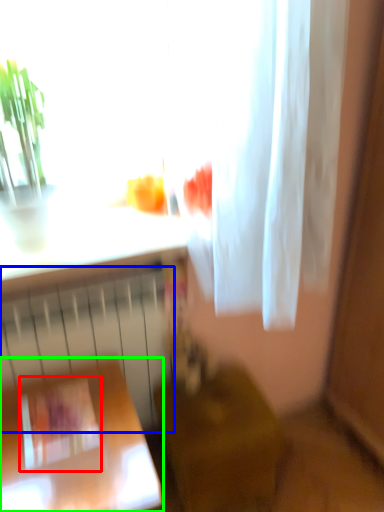
Question: Estimate the real-world distances between objects in this image. Which object is farther from square (highlighted by a red box), radiator (highlighted by a blue box) or furniture (highlighted by a green box)?

Choices:
 (A) radiator
 (B) furniture

Answer: (A)